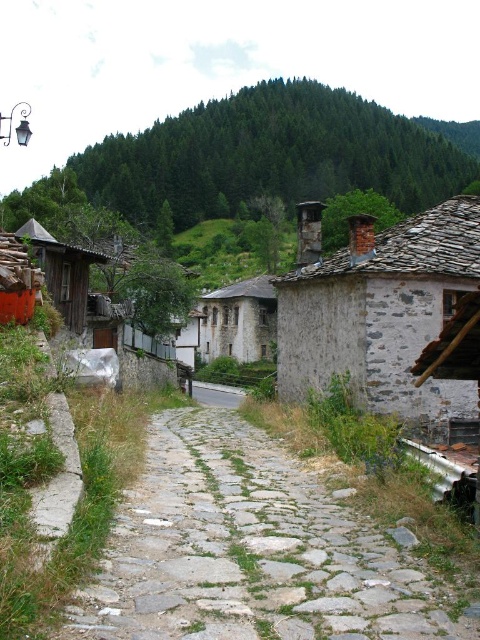
Question: Which object appears farthest from the camera in this image?

Choices:
 (A) wooden hut at left
 (B) gray cobblestone alley at center
 (C) gray stone path at center
 (D) stone textured house at center

Answer: (D)

Question: Which object is farther from the camera taking this photo?

Choices:
 (A) gray cobblestone alley at center
 (B) gray stone path at center

Answer: (A)

Question: Which point is farther from the camera taking this photo?

Choices:
 (A) (372, 278)
 (B) (237, 401)
 (C) (63, 310)

Answer: (B)

Question: From the image, what is the correct spatial relationship of stone textured house at center in relation to gray cobblestone alley at center?

Choices:
 (A) above
 (B) below

Answer: (A)

Question: Can you confirm if stone chimney at right is positioned below stone textured house at center?

Choices:
 (A) no
 (B) yes

Answer: (B)

Question: Does stone chimney at right appear on the left side of gray cobblestone alley at center?

Choices:
 (A) yes
 (B) no

Answer: (B)